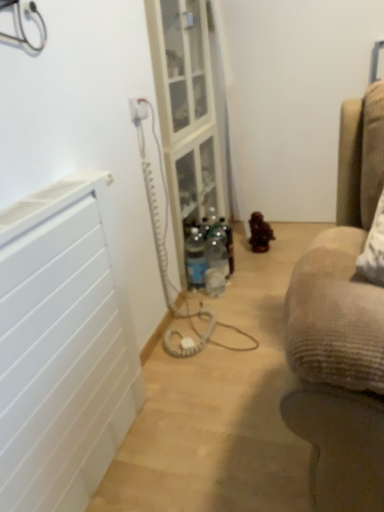
Image resolution: width=384 pixels, height=512 pixels. Find the location of `unoccupied region to the right of clear plastic bottle at center`. unoccupied region to the right of clear plastic bottle at center is located at coordinates (246, 284).